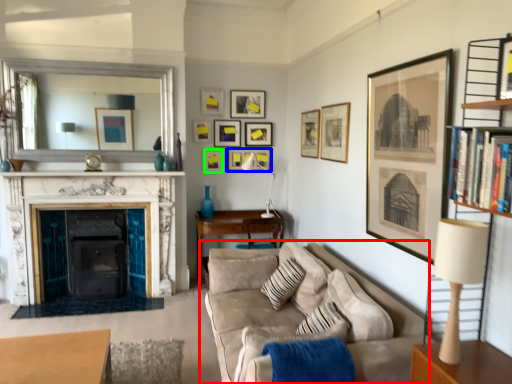
Question: Based on their relative distances, which object is farther from studio couch (highlighted by a red box)? Choose from picture frame (highlighted by a blue box) and picture frame (highlighted by a green box).

Choices:
 (A) picture frame
 (B) picture frame

Answer: (A)